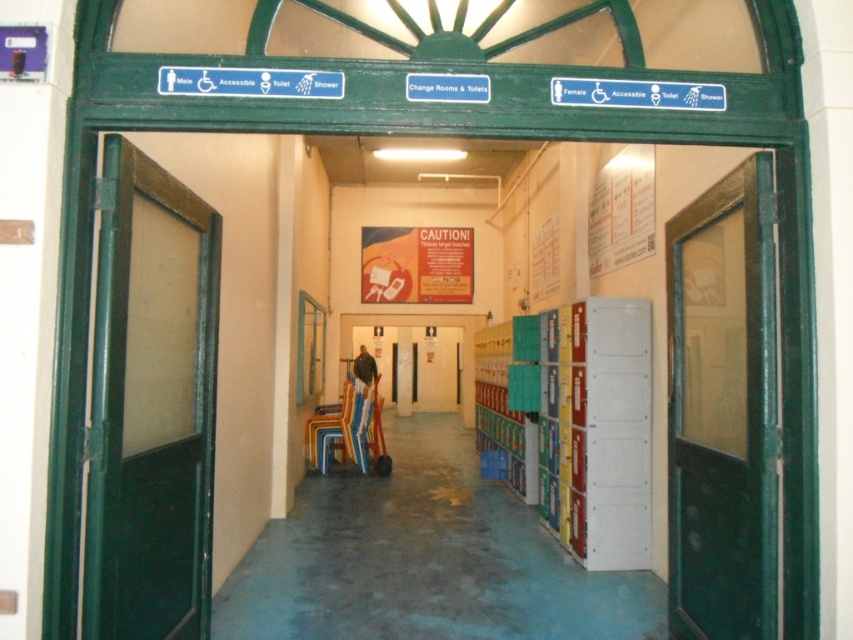
Question: Is green glass door at center below dark gray jacket at center?

Choices:
 (A) yes
 (B) no

Answer: (B)

Question: Does green matte door at left have a greater width compared to green glass door at center?

Choices:
 (A) no
 (B) yes

Answer: (A)

Question: Estimate the real-world distances between objects in this image. Which object is farther from the green glass door at center?

Choices:
 (A) green matte door at left
 (B) dark gray jacket at center

Answer: (B)

Question: Which object is closer to the camera taking this photo?

Choices:
 (A) dark gray jacket at center
 (B) green glass door at center

Answer: (B)

Question: Is green glass door at center positioned in front of dark gray jacket at center?

Choices:
 (A) no
 (B) yes

Answer: (B)

Question: Among these points, which one is farthest from the camera?

Choices:
 (A) (106, 328)
 (B) (672, 308)
 (C) (355, 360)

Answer: (C)